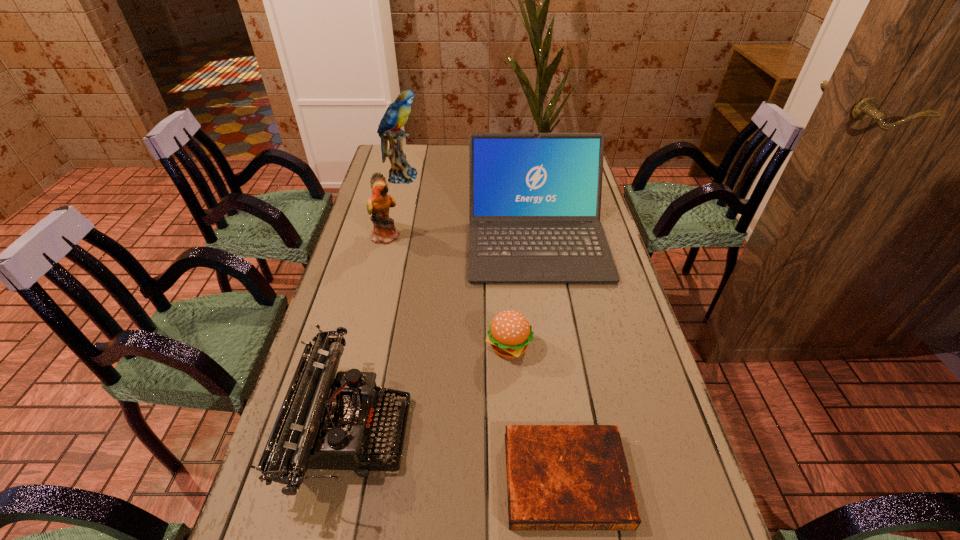
This screenshot has height=540, width=960. Identify the location of free space between the farthest object and the fifth tallest object. (455, 262).

Where is `free space between the typewriter and the nearer parrot`? free space between the typewriter and the nearer parrot is located at coordinates (369, 332).

Identify the location of free point between the typewriter and the laptop computer. The image size is (960, 540). (444, 333).

At what (x,y) coordinates should I click in order to perform the action: click on free space between the laptop computer and the Bible. Please return your answer as a coordinate pair (x, y). Looking at the image, I should click on (551, 358).

The width and height of the screenshot is (960, 540). In order to click on empty space between the fourth tallest object and the nearer parrot in this screenshot , I will do `click(369, 332)`.

The image size is (960, 540). I want to click on vacant area between the nearer parrot and the hamburger, so click(447, 292).

You are a GUI agent. You are given a task and a screenshot of the screen. Output one action in this format:
    pyautogui.click(x=<x>, y=<y>)
    Task: Click on the empty space that is in between the Bible and the fourth tallest object
    This screenshot has width=960, height=540.
    Given the screenshot: What is the action you would take?
    pyautogui.click(x=458, y=454)

Locate an element on the screen. This screenshot has width=960, height=540. the closest object relative to the farthest object is located at coordinates (534, 198).

Select which object is the second closest to the Bible. Please provide its 2D coordinates. Your answer should be formatted as a tuple, i.e. [(x, y)], where the tuple contains the x and y coordinates of a point satisfying the conditions above.

[(325, 422)]

You are a GUI agent. You are given a task and a screenshot of the screen. Output one action in this format:
    pyautogui.click(x=<x>, y=<y>)
    Task: Click on the vacant space that satisfies the following two spatial constraints: 1. on the screen of the laptop computer; 2. on the keyboard of the typewriter
    
    Given the screenshot: What is the action you would take?
    pyautogui.click(x=565, y=429)